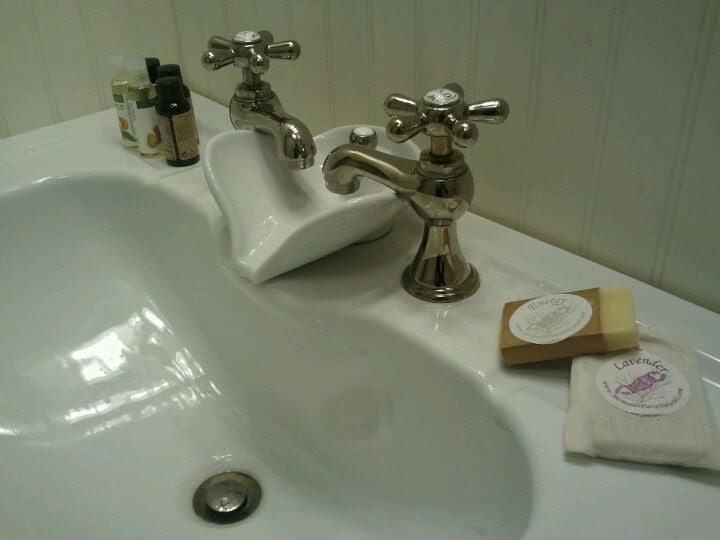
At what (x,y) coordinates should I click in order to perform the action: click on faucet head. Please return your answer as a coordinate pair (x, y). The image size is (720, 540). Looking at the image, I should click on (346, 171), (297, 141).